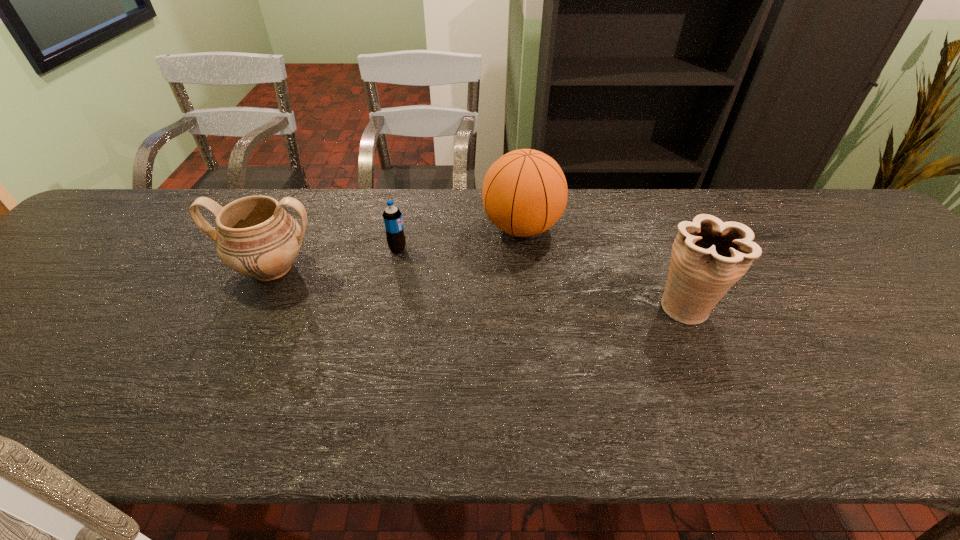
I want to click on free region at the far edge, so click(668, 231).

In the image, there is a desktop. Where is `vacant region at the near edge`? This screenshot has height=540, width=960. vacant region at the near edge is located at coordinates (794, 407).

Find the location of a particular element. This screenshot has width=960, height=540. vacant space at the left edge is located at coordinates (21, 319).

The image size is (960, 540). In the image, there is a desktop. Find the location of `free space at the right edge`. free space at the right edge is located at coordinates (941, 314).

Locate an element on the screen. This screenshot has height=540, width=960. vacant area at the far left corner of the desktop is located at coordinates (113, 214).

What are the coordinates of `free location at the far right corner of the desktop` in the screenshot? It's located at (855, 226).

The image size is (960, 540). Find the location of `free space between the leftmost object and the rightmost object`. free space between the leftmost object and the rightmost object is located at coordinates (480, 288).

This screenshot has height=540, width=960. I want to click on free space between the left urn and the rightmost object, so click(x=480, y=288).

Find the location of `unoccupied area between the third object from left to right and the second object from left to right`. unoccupied area between the third object from left to right and the second object from left to right is located at coordinates (460, 238).

This screenshot has width=960, height=540. I want to click on blank region between the third object from right to left and the leftmost object, so click(x=335, y=258).